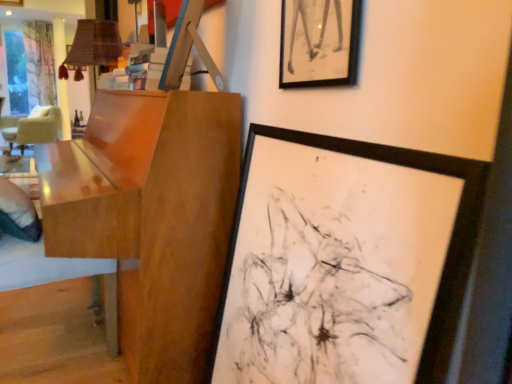
Question: Is black matte picture frame at upper center, the 2th picture frame when ordered from bottom to top, wider than glossy wood table at left?

Choices:
 (A) no
 (B) yes

Answer: (A)

Question: Is black matte picture frame at upper center, the 1th picture frame positioned from the top, outside of glossy wood table at left?

Choices:
 (A) no
 (B) yes

Answer: (B)

Question: Is the position of black matte picture frame at upper center, the 2th picture frame when ordered from bottom to top, more distant than that of glossy wood table at left?

Choices:
 (A) no
 (B) yes

Answer: (A)

Question: Considering the relative sizes of black matte picture frame at upper center, the 1th picture frame positioned from the top, and glossy wood table at left in the image provided, is black matte picture frame at upper center, the 1th picture frame positioned from the top, smaller than glossy wood table at left?

Choices:
 (A) yes
 (B) no

Answer: (A)

Question: From the image's perspective, is black matte picture frame at upper center, the 2th picture frame when ordered from bottom to top, on top of glossy wood table at left?

Choices:
 (A) no
 (B) yes

Answer: (B)

Question: Can you confirm if black matte picture frame at upper center, the 2th picture frame when ordered from bottom to top, is bigger than glossy wood table at left?

Choices:
 (A) no
 (B) yes

Answer: (A)

Question: From a real-world perspective, is glossy wood table at left physically above black matte picture frame at center, marked as the 1th picture frame in a bottom-to-top arrangement?

Choices:
 (A) yes
 (B) no

Answer: (A)

Question: Is glossy wood table at left aimed at black matte picture frame at center, the 2th picture frame viewed from the top?

Choices:
 (A) no
 (B) yes

Answer: (A)

Question: Is glossy wood table at left wider than black matte picture frame at center, the 2th picture frame viewed from the top?

Choices:
 (A) yes
 (B) no

Answer: (A)

Question: Considering the relative positions of glossy wood table at left and black matte picture frame at center, the 2th picture frame viewed from the top, in the image provided, is glossy wood table at left to the right of black matte picture frame at center, the 2th picture frame viewed from the top, from the viewer's perspective?

Choices:
 (A) yes
 (B) no

Answer: (B)

Question: Does glossy wood table at left come behind black matte picture frame at center, marked as the 1th picture frame in a bottom-to-top arrangement?

Choices:
 (A) yes
 (B) no

Answer: (A)

Question: Is glossy wood table at left to the left of black matte picture frame at center, marked as the 1th picture frame in a bottom-to-top arrangement, from the viewer's perspective?

Choices:
 (A) no
 (B) yes

Answer: (B)

Question: Considering the relative positions of black matte picture frame at center, the 2th picture frame viewed from the top, and glossy wood table at left in the image provided, is black matte picture frame at center, the 2th picture frame viewed from the top, to the right of glossy wood table at left from the viewer's perspective?

Choices:
 (A) no
 (B) yes

Answer: (B)